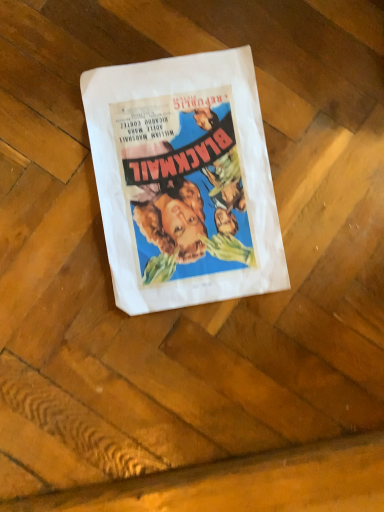
Locate an element on the screen. empty space that is ontop of white paper at center (from a real-world perspective) is located at coordinates (194, 165).